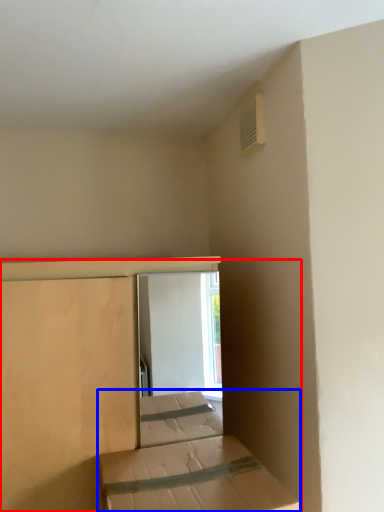
Question: Which object is closer to the camera taking this photo, bed (highlighted by a red box) or bed (highlighted by a blue box)?

Choices:
 (A) bed
 (B) bed

Answer: (B)